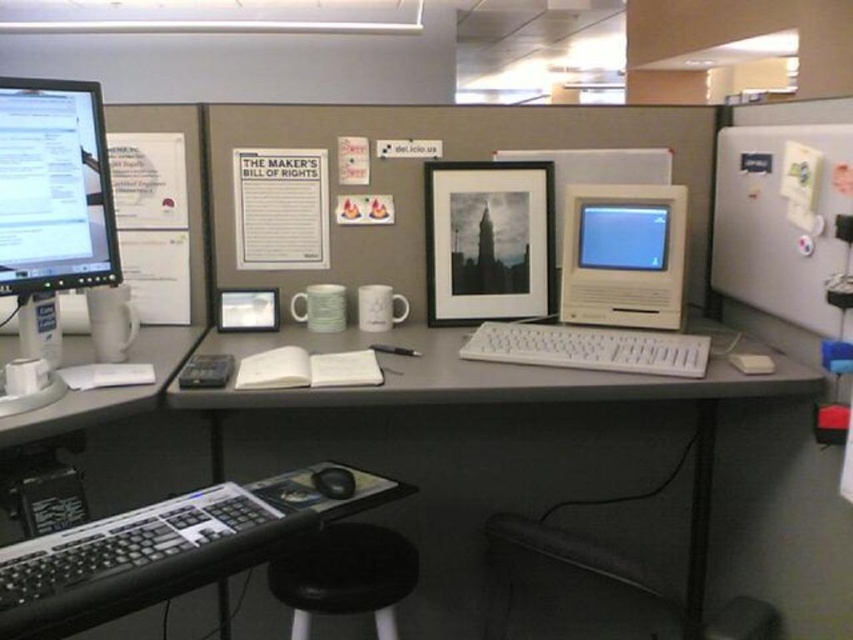
Question: Does white plastic computer monitor at upper right appear under white plastic keyboard at center?

Choices:
 (A) no
 (B) yes

Answer: (A)

Question: Is black plastic keyboard at lower left behind white plastic keyboard at center?

Choices:
 (A) yes
 (B) no

Answer: (B)

Question: Which object is farther from the camera taking this photo?

Choices:
 (A) black plastic keyboard at lower left
 (B) white plastic computer at center
 (C) black matte frame at center
 (D) black leather stool at lower center

Answer: (C)

Question: Which of the following is the farthest from the observer?

Choices:
 (A) (607, 280)
 (B) (627, 349)

Answer: (A)

Question: From the image, what is the correct spatial relationship of white plastic table at center in relation to black leather swivel chair at lower center?

Choices:
 (A) left
 (B) right

Answer: (A)

Question: Among these points, which one is nearest to the camera?

Choices:
 (A) (599, 211)
 (B) (175, 586)

Answer: (B)